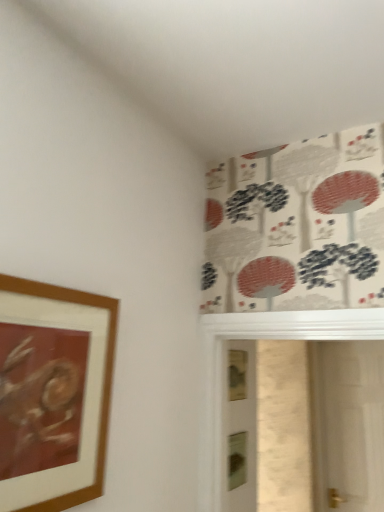
This screenshot has height=512, width=384. Identify the location of transparent glass screen door at right. (347, 424).

This screenshot has width=384, height=512. What do you see at coordinates (347, 424) in the screenshot?
I see `transparent glass screen door at right` at bounding box center [347, 424].

Describe the element at coordinates (53, 393) in the screenshot. I see `wooden picture frame at left` at that location.

In order to face wooden picture frame at left, should I rotate leftwards or rightwards?

Turn left by 17.844 degrees to look at wooden picture frame at left.

You are a GUI agent. You are given a task and a screenshot of the screen. Output one action in this format:
    pyautogui.click(x=<x>, y=<y>)
    Task: Click on the wooden picture frame at left
    This screenshot has width=384, height=512.
    Given the screenshot: What is the action you would take?
    pyautogui.click(x=53, y=393)

Where is `transparent glass screen door at right`? transparent glass screen door at right is located at coordinates (347, 424).

Can you confirm if wooden picture frame at left is positioned to the left of transparent glass screen door at right?

Yes.

Considering the positions of objects wooden picture frame at left and transparent glass screen door at right in the image provided, who is in front, wooden picture frame at left or transparent glass screen door at right?

wooden picture frame at left is more forward.

Between point (59, 490) and point (335, 355), which one is positioned in front?

Point (59, 490)

From the image's perspective, which one is positioned lower, wooden picture frame at left or transparent glass screen door at right?

transparent glass screen door at right appears lower in the image.

From a real-world perspective, is wooden picture frame at left physically above transparent glass screen door at right?

Correct, in the physical world, wooden picture frame at left is higher than transparent glass screen door at right.

Considering the relative sizes of wooden picture frame at left and transparent glass screen door at right in the image provided, is wooden picture frame at left thinner than transparent glass screen door at right?

Indeed, wooden picture frame at left has a lesser width compared to transparent glass screen door at right.

Between wooden picture frame at left and transparent glass screen door at right, which one has more height?

Standing taller between the two is transparent glass screen door at right.

Does wooden picture frame at left have a larger size compared to transparent glass screen door at right?

Actually, wooden picture frame at left might be smaller than transparent glass screen door at right.

Is wooden picture frame at left located outside transparent glass screen door at right?

wooden picture frame at left lies outside transparent glass screen door at right's area.

Is the surface of wooden picture frame at left in direct contact with transparent glass screen door at right?

There is a gap between wooden picture frame at left and transparent glass screen door at right.

Is wooden picture frame at left positioned with its back to transparent glass screen door at right?

No, wooden picture frame at left is not facing away from transparent glass screen door at right.

Identify the location of picture frame above the transparent glass screen door at right (from the image's perspective). (53, 393).

Is transparent glass screen door at right to the left of wooden picture frame at left from the viewer's perspective?

No, transparent glass screen door at right is not to the left of wooden picture frame at left.

Which object is closer to the camera, transparent glass screen door at right or wooden picture frame at left?

wooden picture frame at left is closer to the camera.

Is point (334, 509) closer or farther from the camera than point (108, 400)?

Point (334, 509) is positioned farther from the camera compared to point (108, 400).

From the image's perspective, does transparent glass screen door at right appear lower than wooden picture frame at left?

Yes, from the image's perspective, transparent glass screen door at right is beneath wooden picture frame at left.

From a real-world perspective, is transparent glass screen door at right positioned over wooden picture frame at left based on gravity?

No, from a real-world perspective, transparent glass screen door at right is not on top of wooden picture frame at left.

Is transparent glass screen door at right wider than wooden picture frame at left?

Yes.

Considering the relative sizes of transparent glass screen door at right and wooden picture frame at left in the image provided, is transparent glass screen door at right shorter than wooden picture frame at left?

In fact, transparent glass screen door at right may be taller than wooden picture frame at left.

Is transparent glass screen door at right bigger than wooden picture frame at left?

Yes.

Is transparent glass screen door at right surrounding wooden picture frame at left?

No, wooden picture frame at left is not a part of transparent glass screen door at right.

Would you say transparent glass screen door at right is a long distance from wooden picture frame at left?

Absolutely, transparent glass screen door at right is distant from wooden picture frame at left.

Could you tell me if transparent glass screen door at right is facing wooden picture frame at left?

Yes, transparent glass screen door at right faces towards wooden picture frame at left.

How many degrees apart are the facing directions of transparent glass screen door at right and wooden picture frame at left?

They differ by 94 degrees in their facing directions.

Identify the location of screen door below the wooden picture frame at left (from a real-world perspective). (347, 424).

You are a GUI agent. You are given a task and a screenshot of the screen. Output one action in this format:
    pyautogui.click(x=<x>, y=<y>)
    Task: Click on the picture frame located above the transparent glass screen door at right (from a real-world perspective)
    This screenshot has width=384, height=512.
    Given the screenshot: What is the action you would take?
    pyautogui.click(x=53, y=393)

At what (x,y) coordinates should I click in order to perform the action: click on screen door located below the wooden picture frame at left (from the image's perspective). Please return your answer as a coordinate pair (x, y). The width and height of the screenshot is (384, 512). Looking at the image, I should click on (347, 424).